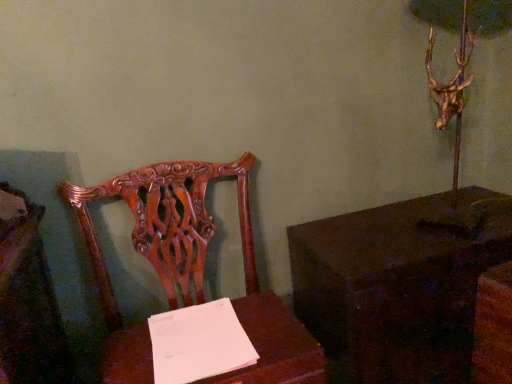
Question: Does polished wood chair at center turn towards wooden table at center, which ranks as the second table in right-to-left order?

Choices:
 (A) yes
 (B) no

Answer: (A)

Question: Is polished wood chair at center outside of wooden table at center, which ranks as the second table in right-to-left order?

Choices:
 (A) yes
 (B) no

Answer: (A)

Question: From a real-world perspective, is polished wood chair at center located higher than wooden table at center, which is the first table from left to right?

Choices:
 (A) yes
 (B) no

Answer: (B)

Question: Does polished wood chair at center contain wooden table at center, which ranks as the second table in right-to-left order?

Choices:
 (A) yes
 (B) no

Answer: (A)

Question: Can you confirm if polished wood chair at center is taller than wooden table at center, which ranks as the second table in right-to-left order?

Choices:
 (A) no
 (B) yes

Answer: (B)

Question: From the image's perspective, does polished wood chair at center appear lower than wooden table at center, which is the first table from left to right?

Choices:
 (A) yes
 (B) no

Answer: (B)

Question: Is polished wood chair at center at the back of wooden table at center, which ranks as the second table in right-to-left order?

Choices:
 (A) no
 (B) yes

Answer: (B)

Question: Does wooden table at center, which is the first table from left to right, appear on the right side of polished wood chair at center?

Choices:
 (A) no
 (B) yes

Answer: (B)

Question: Is polished wood chair at center inside wooden table at center, which ranks as the second table in right-to-left order?

Choices:
 (A) no
 (B) yes

Answer: (A)

Question: From the image's perspective, is wooden table at center, which is the first table from left to right, on polished wood chair at center?

Choices:
 (A) no
 (B) yes

Answer: (A)

Question: Could you tell me if wooden table at center, which ranks as the second table in right-to-left order, is facing polished wood chair at center?

Choices:
 (A) no
 (B) yes

Answer: (B)

Question: Does wooden table at center, which ranks as the second table in right-to-left order, have a larger size compared to polished wood chair at center?

Choices:
 (A) no
 (B) yes

Answer: (A)

Question: Could you tell me if polished wood chair at center is turned towards dark wood table at right, which is counted as the first table, starting from the right?

Choices:
 (A) no
 (B) yes

Answer: (A)